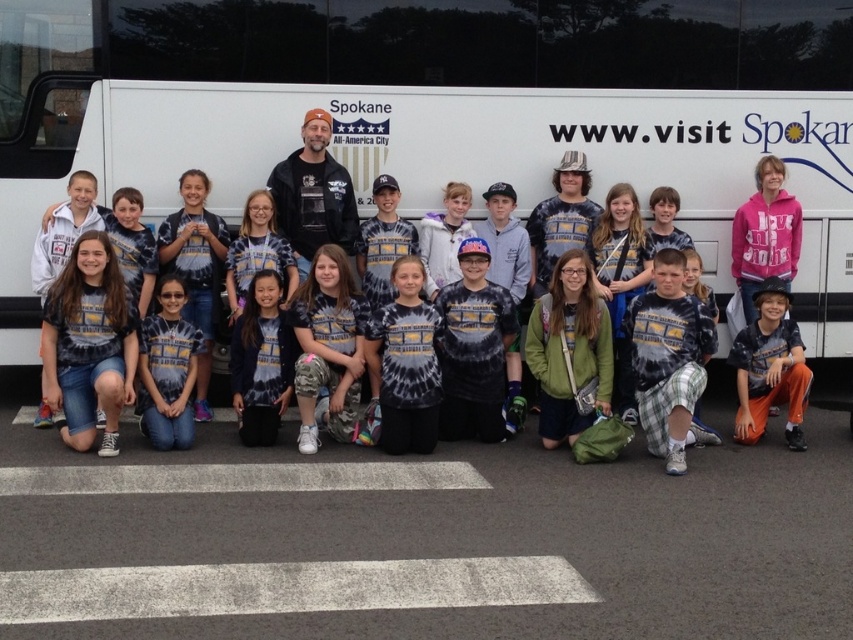
Question: Is the position of tie-dye shirt at lower left more distant than that of orange cotton pants at lower right?

Choices:
 (A) yes
 (B) no

Answer: (B)

Question: Which object appears closest to the camera in this image?

Choices:
 (A) tie-dye shirt at lower left
 (B) pink fleece sweatshirt at upper right

Answer: (A)

Question: Which object appears farthest from the camera in this image?

Choices:
 (A) orange cotton pants at lower right
 (B) pink fleece sweatshirt at upper right

Answer: (B)

Question: Is tie-dye shirt at lower left in front of tie-dye fabric shirt at center?

Choices:
 (A) no
 (B) yes

Answer: (A)

Question: Can you confirm if green matte jacket at center is wider than tie-dye shirt at lower center?

Choices:
 (A) yes
 (B) no

Answer: (A)

Question: Which point is closer to the camera?

Choices:
 (A) tie-dye shirt at center
 (B) orange cotton pants at lower right
 (C) tie-dye shirt at lower left
 (D) tie-dye shirt at lower center

Answer: (C)